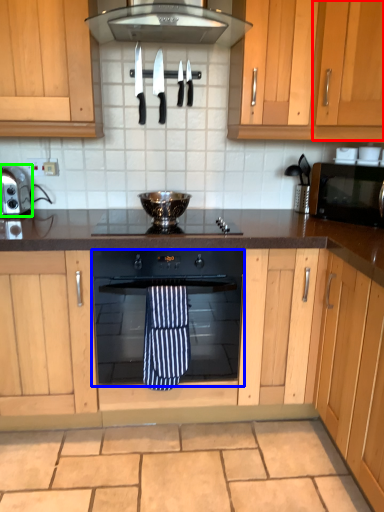
Question: Which is farther away from cabinetry (highlighted by a red box)? oven (highlighted by a blue box) or kitchen appliance (highlighted by a green box)?

Choices:
 (A) oven
 (B) kitchen appliance

Answer: (B)